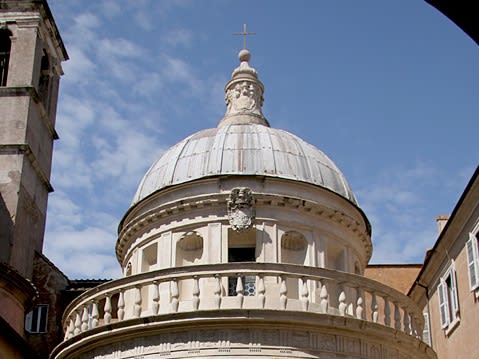
Find the location of a particular element. Image resolution: width=479 pixels, height=359 pixels. windows is located at coordinates (450, 297), (477, 239), (423, 335), (248, 285), (37, 321).